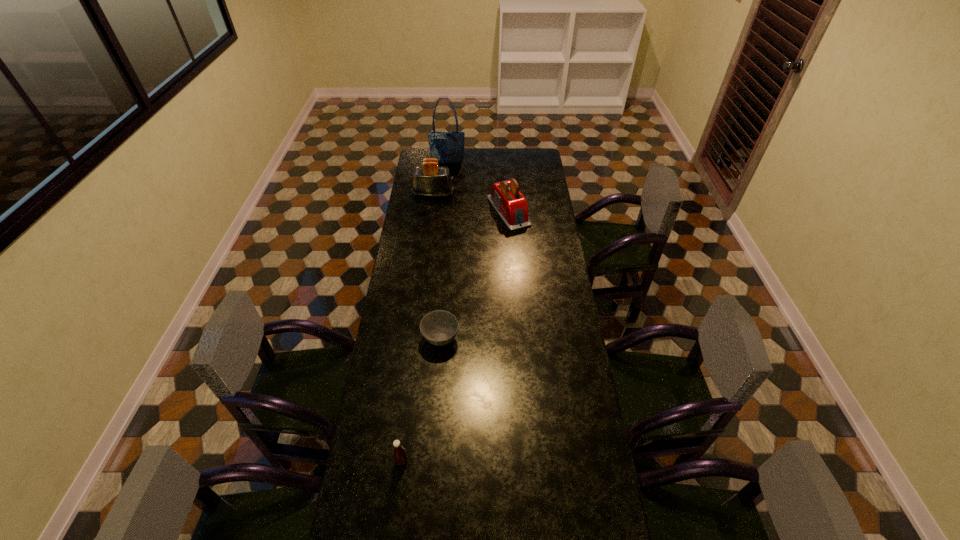
Identify the location of free point that satisfies the following two spatial constraints: 1. on the side of the right toaster with the control lever; 2. on the left side of the left toaster. (431, 211).

You are a GUI agent. You are given a task and a screenshot of the screen. Output one action in this format:
    pyautogui.click(x=<x>, y=<y>)
    Task: Click on the vacant space that satisfies the following two spatial constraints: 1. on the front-facing side of the farthest object; 2. on the side of the left toaster with the control lever
    
    Given the screenshot: What is the action you would take?
    pyautogui.click(x=444, y=194)